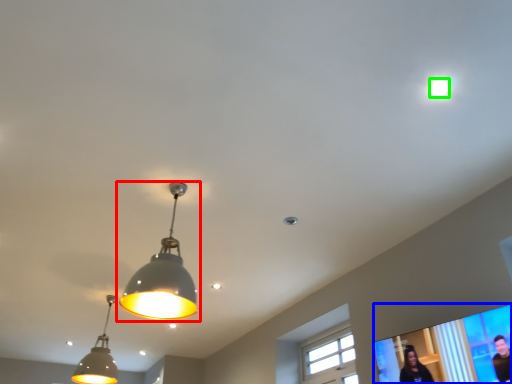
Question: Which object is positioned closest to lamp (highlighted by a red box)? Select from projection screen (highlighted by a blue box) and droplight (highlighted by a green box).

Choices:
 (A) projection screen
 (B) droplight

Answer: (A)